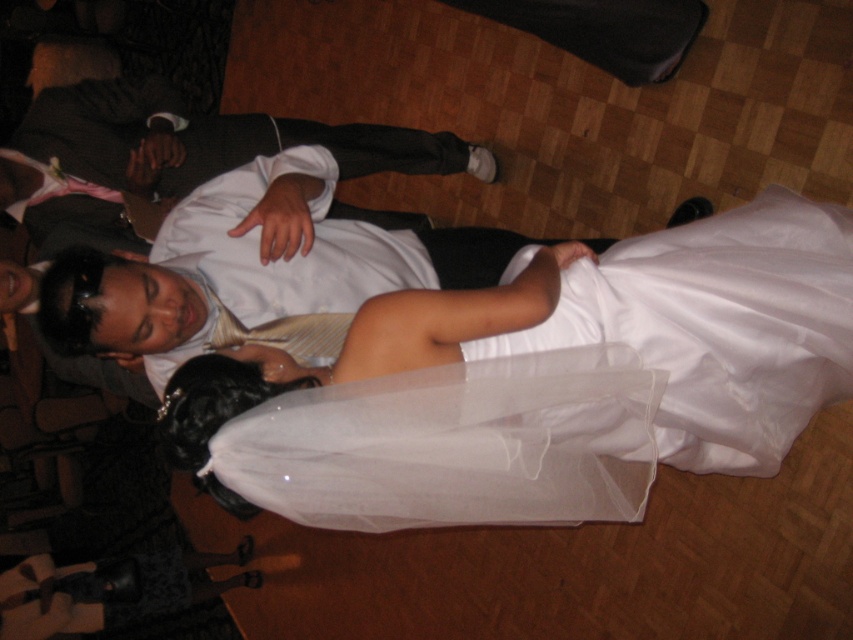
Question: Can you confirm if white sheer dress at center is positioned below white satin shirt at center?

Choices:
 (A) no
 (B) yes

Answer: (B)

Question: Which of the following is the closest to the observer?

Choices:
 (A) white satin shirt at center
 (B) white sheer dress at center

Answer: (B)

Question: Does white sheer dress at center have a lesser width compared to white satin shirt at center?

Choices:
 (A) no
 (B) yes

Answer: (A)

Question: Can you confirm if white sheer dress at center is positioned to the left of white satin shirt at center?

Choices:
 (A) yes
 (B) no

Answer: (B)